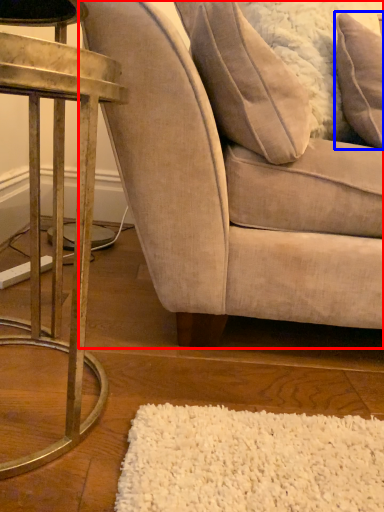
Question: Which point is closer to the camera, chair (highlighted by a red box) or pillow (highlighted by a blue box)?

Choices:
 (A) chair
 (B) pillow

Answer: (A)